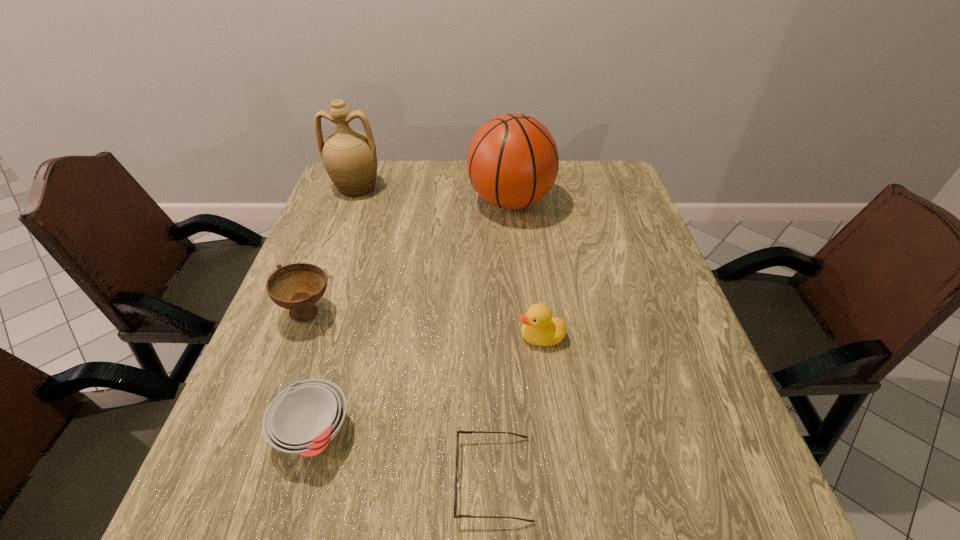
You are a GUI agent. You are given a task and a screenshot of the screen. Output one action in this format:
    pyautogui.click(x=<x>, y=<y>)
    Task: Click on the pitcher
    Image resolution: width=960 pixels, height=540 pixels.
    Given the screenshot: What is the action you would take?
    pyautogui.click(x=349, y=156)

Where is `basketball`? The image size is (960, 540). basketball is located at coordinates (512, 162).

Identify the location of the farther soup bowl. (297, 287).

What are the coordinates of `the fourth tallest object` in the screenshot? It's located at [539, 328].

Locate an element on the screen. This screenshot has height=540, width=960. the fifth tallest object is located at coordinates (302, 419).

Find the location of a particular element. The height and width of the screenshot is (540, 960). the nearer soup bowl is located at coordinates (302, 419).

The height and width of the screenshot is (540, 960). I want to click on the shortest object, so click(x=457, y=480).

Where is `free point located 0.140m on the front of the pitcher`? The height and width of the screenshot is (540, 960). free point located 0.140m on the front of the pitcher is located at coordinates (340, 231).

What are the coordinates of `free region located 0.260m on the left of the basketball` in the screenshot? It's located at (379, 202).

Locate an element on the screen. free space located on the right of the farther soup bowl is located at coordinates (500, 312).